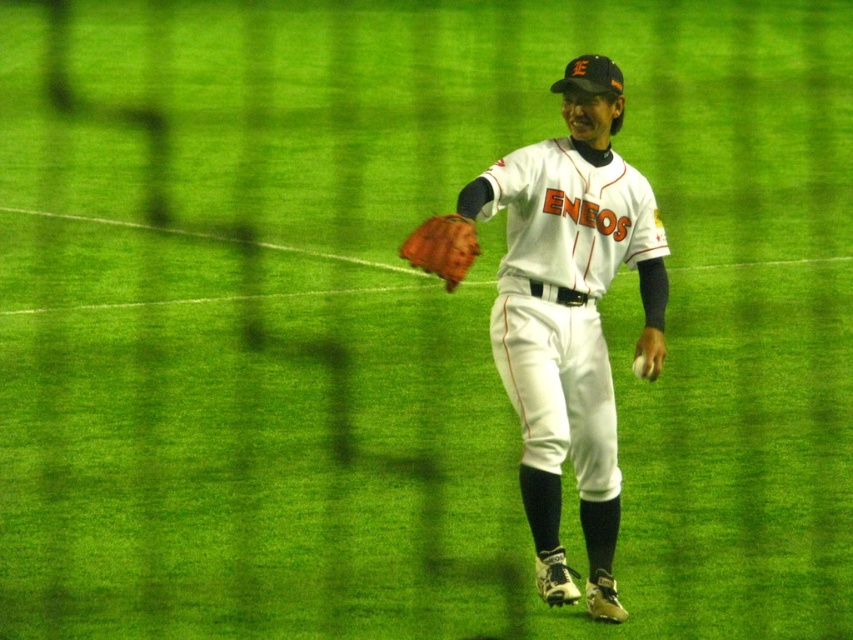
You are a baseball coach observing the field. You notice the white matte baseball glove at center and the white matte baseball at center. Which object is larger?

The white matte baseball glove at center is bigger than the white matte baseball at center.

You are a coach observing a player holding a brown leather glove at center and a white matte baseball at center. Which object is bigger?

The brown leather glove at center is larger in size than the white matte baseball at center.